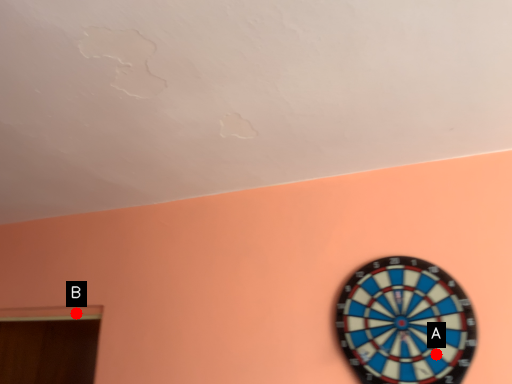
Question: Two points are circled on the image, labeled by A and B beside each circle. Which point is closer to the camera taking this photo?

Choices:
 (A) A is closer
 (B) B is closer

Answer: (A)